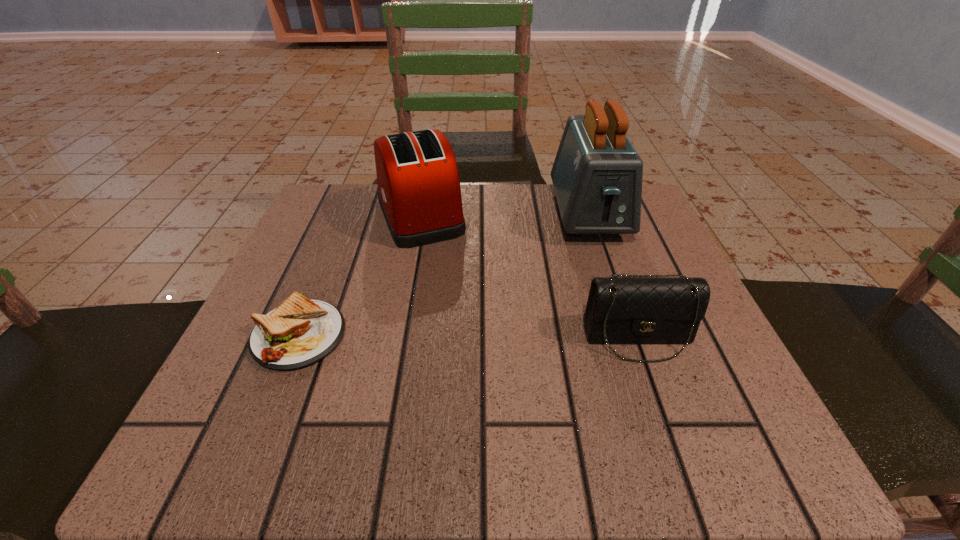
The height and width of the screenshot is (540, 960). In order to click on the taller toaster in this screenshot , I will do `click(597, 174)`.

This screenshot has height=540, width=960. What are the coordinates of `the right toaster` in the screenshot? It's located at (597, 174).

Locate an element on the screen. This screenshot has width=960, height=540. the left toaster is located at coordinates coord(419,192).

Locate an element on the screen. The width and height of the screenshot is (960, 540). the shorter toaster is located at coordinates (419, 192).

Identify the location of clutch bag. (631, 309).

Find the location of a particular element. The width and height of the screenshot is (960, 540). the shortest object is located at coordinates (300, 332).

Where is `free space located on the front-facing side of the taller toaster`? This screenshot has height=540, width=960. free space located on the front-facing side of the taller toaster is located at coordinates (627, 327).

You are a GUI agent. You are given a task and a screenshot of the screen. Output one action in this format:
    pyautogui.click(x=<x>, y=<y>)
    Task: Click on the free space located 0.240m on the front of the second tallest object
    The width and height of the screenshot is (960, 540).
    Given the screenshot: What is the action you would take?
    pyautogui.click(x=396, y=343)

Identify the location of free space located on the front flap of the clutch bag. The image size is (960, 540). (676, 446).

Identify the location of blank area located on the back of the sandwich. point(354,202).